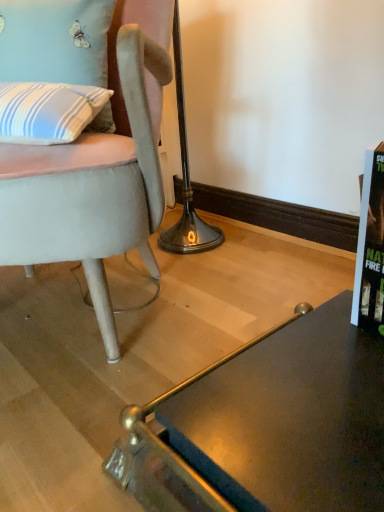
Identify the location of free spot below suede-like gray chair at left (from a real-world perspective). The height and width of the screenshot is (512, 384). (84, 300).